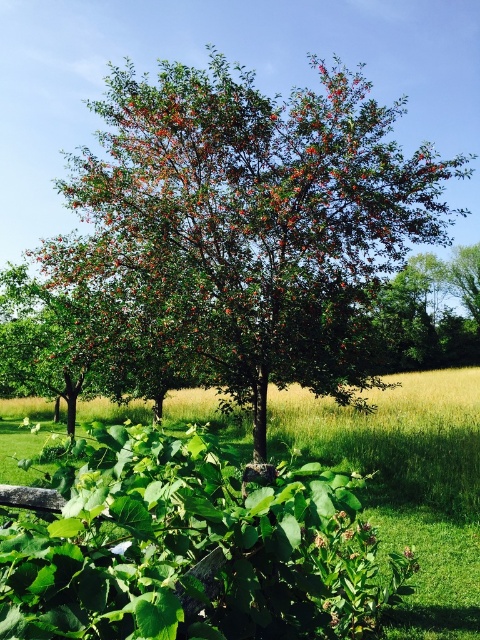
Based on the photo, you are a gardener who needs to plant a new shrub that requires a minimum of 50 feet of space between it and any existing plants. You have two options in the scene to consider as potential planting spots. The first is near the green leafy bush at center, and the second is near the white matte flower at center. Based on the spacing between these two objects, which location would be suitable for planting the new shrub without violating the spacing requirement?

The distance between the green leafy bush at center and the white matte flower at center is 52.87 feet. Since this distance exceeds the required 50 feet, either location would be suitable for planting the new shrub as they are sufficiently spaced apart.

You are standing at the point with coordinates point (121, 548) and want to walk towards the point with coordinates point (85, 161). Will the large tree with dense canopy of green leaves and clusters of small red berries block your path?

Point (85, 161) is behind point (121, 548), so the large tree with dense canopy of green leaves and clusters of small red berries will block your path to point (85, 161).

You are standing in the middle of a forest and see the green leafy tree at center and the green leafy bush at center. Which one is closer to you?

The green leafy tree at center is closer to you because the green leafy bush at center is behind it.